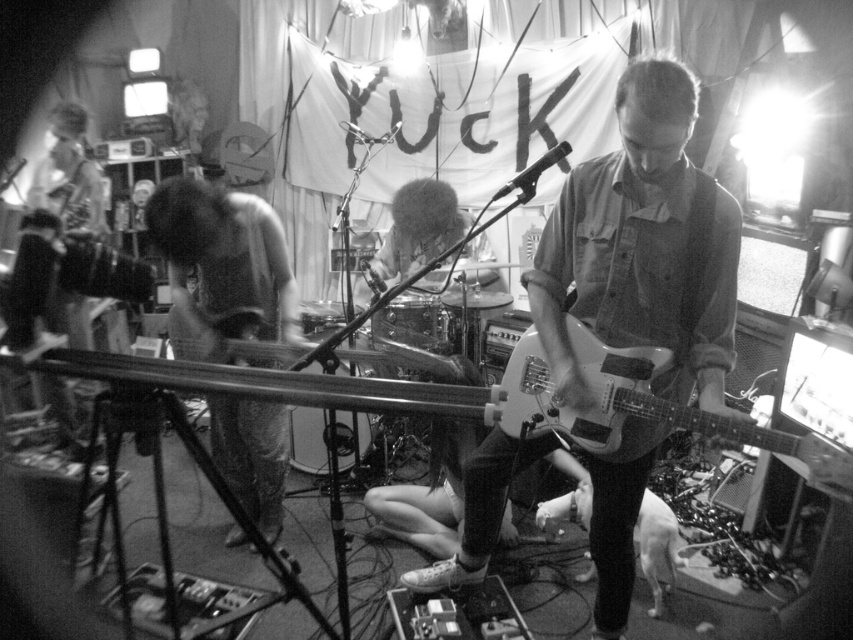
Question: Considering the relative positions of matte white guitar at center and matte black guitar at left in the image provided, where is matte white guitar at center located with respect to matte black guitar at left?

Choices:
 (A) above
 (B) below

Answer: (B)

Question: Is denim pants at left further to the viewer compared to matte black guitar at left?

Choices:
 (A) no
 (B) yes

Answer: (A)

Question: Which point is closer to the camera taking this photo?

Choices:
 (A) (491, 506)
 (B) (71, 138)
 (C) (809, 474)

Answer: (C)

Question: Estimate the real-world distances between objects in this image. Which object is closer to the matte black guitar at left?

Choices:
 (A) matte white guitar at center
 (B) denim pants at left
 (C) white glossy guitar at center

Answer: (B)

Question: Which point is farther to the camera?

Choices:
 (A) (642, 307)
 (B) (540, 413)
 (C) (244, 262)
 (D) (44, 134)

Answer: (D)

Question: Does denim pants at left have a greater width compared to white glossy guitar at center?

Choices:
 (A) yes
 (B) no

Answer: (B)